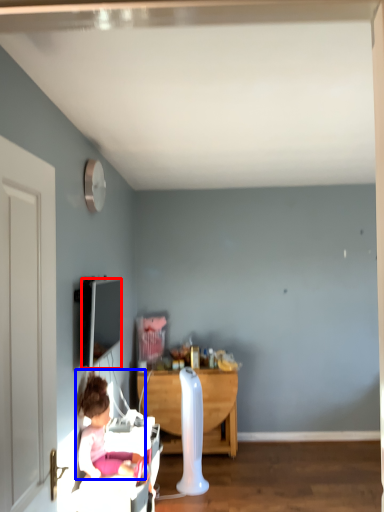
Question: Which point is further to the camera, television (highlighted by a red box) or person (highlighted by a blue box)?

Choices:
 (A) television
 (B) person

Answer: (A)